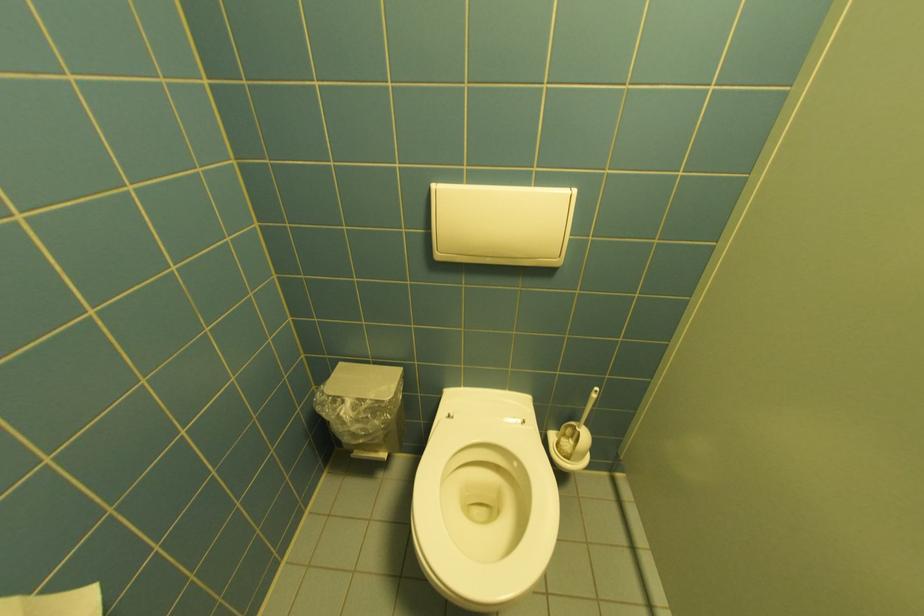
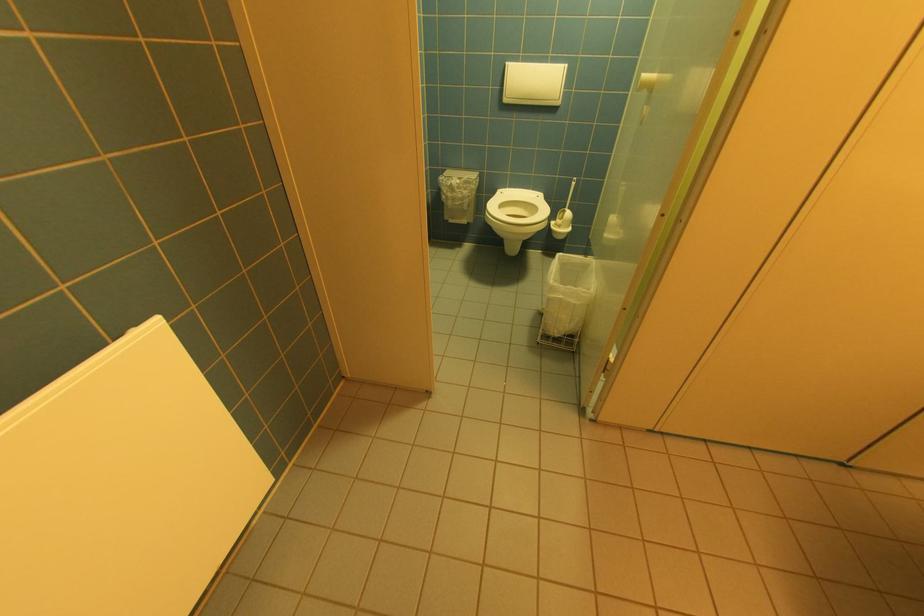
Find the pixel in the second image that matches point 470,387 in the first image.

(515, 188)